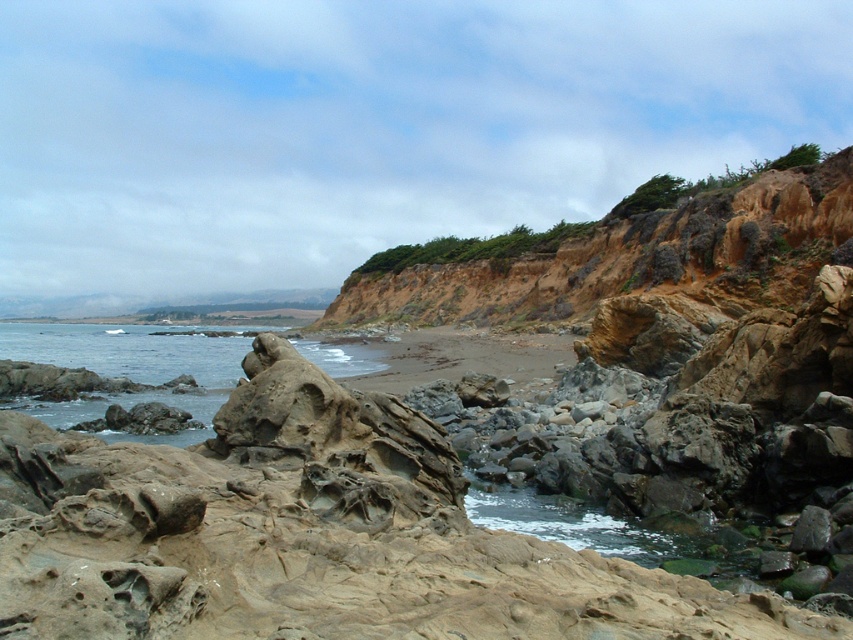
Question: Does brown rocky cliff at upper right have a larger size compared to clear water at center?

Choices:
 (A) no
 (B) yes

Answer: (A)

Question: Among these points, which one is farthest from the camera?

Choices:
 (A) (711, 296)
 (B) (335, 358)

Answer: (B)

Question: Does brown rocky cliff at upper right appear under clear water at center?

Choices:
 (A) no
 (B) yes

Answer: (A)

Question: Is brown rocky cliff at upper right positioned in front of clear water at center?

Choices:
 (A) no
 (B) yes

Answer: (A)

Question: Which object is closer to the camera taking this photo?

Choices:
 (A) brown rocky cliff at upper right
 (B) clear water at center

Answer: (B)